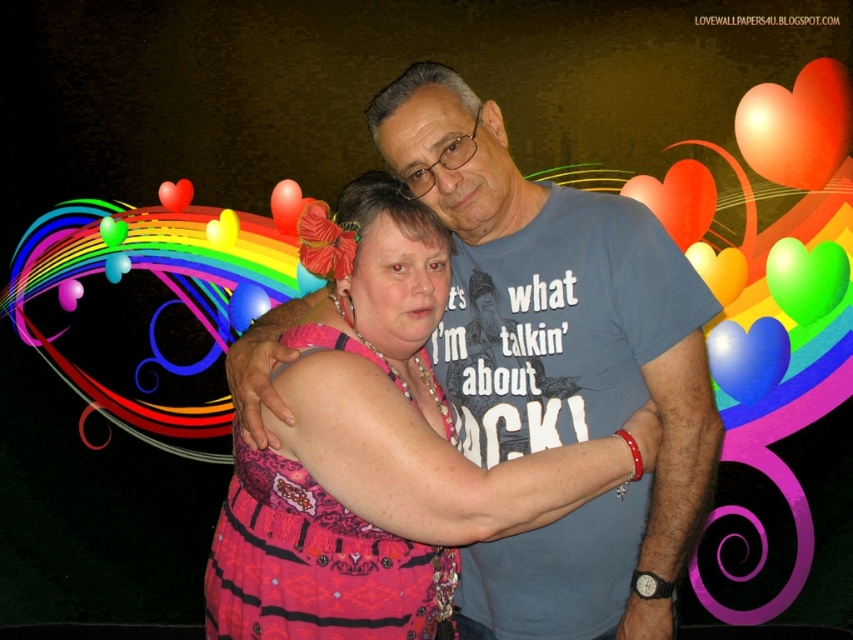
Who is more forward, (772, 378) or (262, 308)?

Point (772, 378) is more forward.

Is blue glossy balloon at upper right further to the viewer compared to translucent plastic balloon at center?

No, blue glossy balloon at upper right is closer to the viewer.

Image resolution: width=853 pixels, height=640 pixels. In order to click on blue glossy balloon at upper right in this screenshot , I will do click(x=747, y=356).

Can you confirm if pink rubber balloon at center is positioned above translucent pink balloon at upper left?

Incorrect, pink rubber balloon at center is not positioned above translucent pink balloon at upper left.

Which is below, pink rubber balloon at center or translucent pink balloon at upper left?

pink rubber balloon at center is lower down.

The width and height of the screenshot is (853, 640). Find the location of `pink rubber balloon at center`. pink rubber balloon at center is located at coordinates (68, 292).

Locate an element on the screen. This screenshot has width=853, height=640. pink rubber balloon at center is located at coordinates (68, 292).

Is shiny red heart at upper right positioned before rubber heart at upper left?

Yes, it is in front of rubber heart at upper left.

Who is lower down, shiny red heart at upper right or rubber heart at upper left?

rubber heart at upper left is below.

The image size is (853, 640). I want to click on shiny red heart at upper right, so (798, 125).

Where is `shiny red heart at upper right`? shiny red heart at upper right is located at coordinates (798, 125).